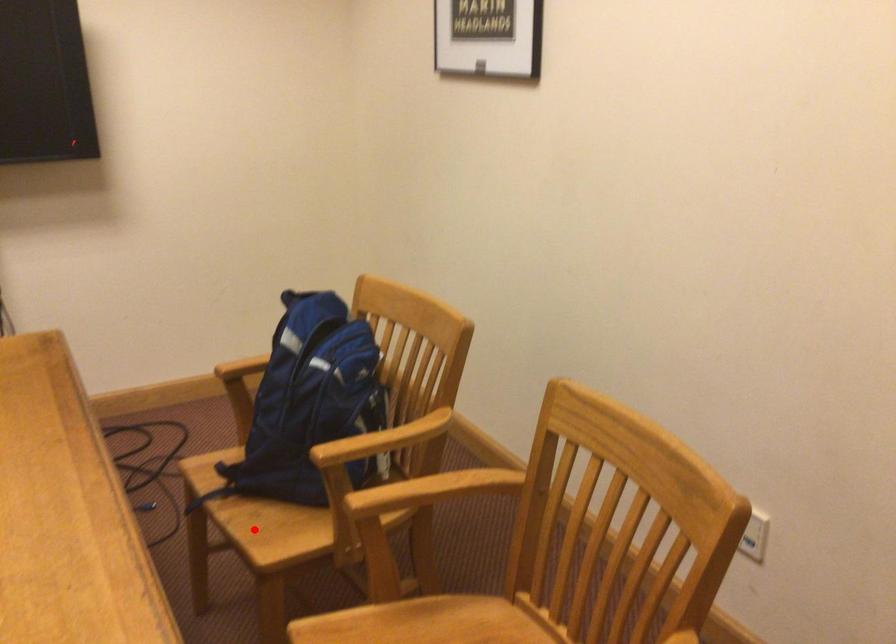
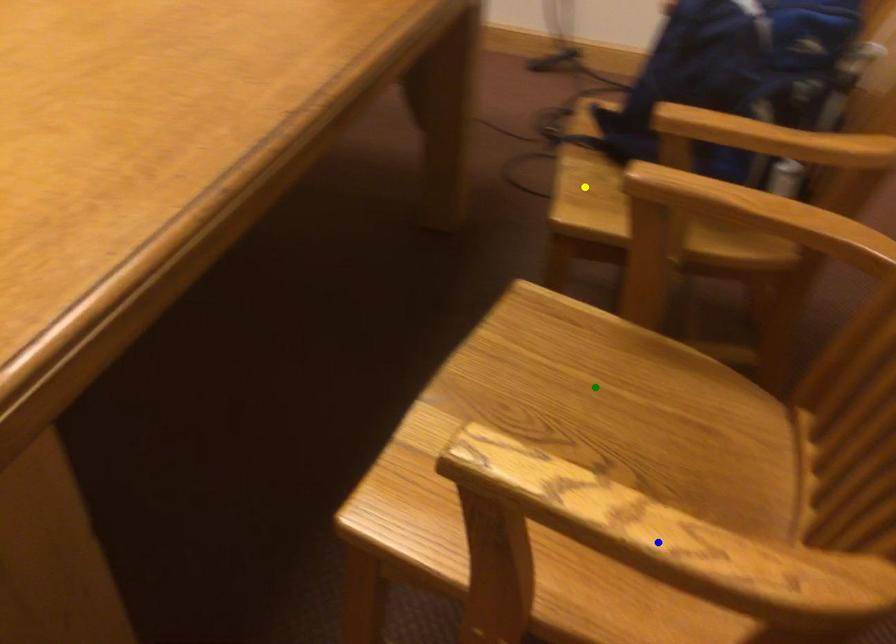
Question: I am providing you with two images of the same scene from different viewpoints. A red point is marked on the first image. You are given multiple points on the second image. Can you choose the point in image 2 that corresponds to the point in image 1?

Choices:
 (A) yellow point
 (B) green point
 (C) blue point

Answer: (A)